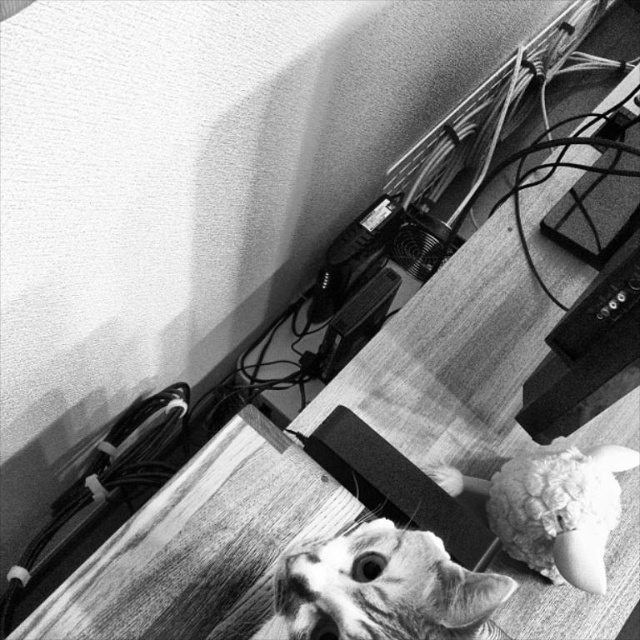
Is tabby fur cat at center to the left of fluffy fabric doll at lower right from the viewer's perspective?

Indeed, tabby fur cat at center is positioned on the left side of fluffy fabric doll at lower right.

What do you see at coordinates (385, 588) in the screenshot? I see `tabby fur cat at center` at bounding box center [385, 588].

Find the location of a particular element. Image resolution: width=640 pixels, height=640 pixels. tabby fur cat at center is located at coordinates (385, 588).